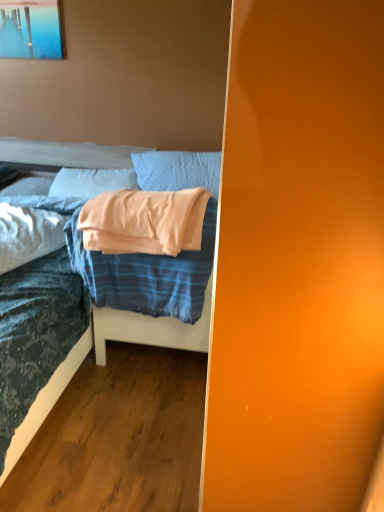
Question: Is metallic glossy picture frame at upper left bigger than light blue fabric pillow at upper center, arranged as the second pillow when viewed from the front?

Choices:
 (A) no
 (B) yes

Answer: (A)

Question: Is metallic glossy picture frame at upper left facing towards light blue fabric pillow at upper center, arranged as the second pillow when viewed from the front?

Choices:
 (A) yes
 (B) no

Answer: (B)

Question: Would you consider metallic glossy picture frame at upper left to be distant from light blue fabric pillow at upper center, arranged as the second pillow when viewed from the front?

Choices:
 (A) no
 (B) yes

Answer: (B)

Question: Considering the relative positions of metallic glossy picture frame at upper left and light blue fabric pillow at upper center, the third pillow from the back, in the image provided, is metallic glossy picture frame at upper left to the left of light blue fabric pillow at upper center, the third pillow from the back, from the viewer's perspective?

Choices:
 (A) yes
 (B) no

Answer: (A)

Question: From a real-world perspective, is metallic glossy picture frame at upper left located beneath light blue fabric pillow at upper center, the third pillow from the back?

Choices:
 (A) no
 (B) yes

Answer: (A)

Question: Considering the positions of metallic glossy picture frame at upper left and blue plaid bed at lower left in the image, is metallic glossy picture frame at upper left wider or thinner than blue plaid bed at lower left?

Choices:
 (A) thin
 (B) wide

Answer: (A)

Question: Is metallic glossy picture frame at upper left taller or shorter than blue plaid bed at lower left?

Choices:
 (A) short
 (B) tall

Answer: (B)

Question: Is point (44, 56) positioned closer to the camera than point (82, 357)?

Choices:
 (A) closer
 (B) farther

Answer: (B)

Question: From the image's perspective, relative to blue plaid bed at lower left, is metallic glossy picture frame at upper left above or below?

Choices:
 (A) below
 (B) above

Answer: (B)

Question: Is metallic glossy picture frame at upper left to the left or to the right of white soft pillow at upper left, arranged as the 1th pillow when viewed from the back, in the image?

Choices:
 (A) left
 (B) right

Answer: (B)

Question: In terms of width, does metallic glossy picture frame at upper left look wider or thinner when compared to white soft pillow at upper left, arranged as the 1th pillow when viewed from the back?

Choices:
 (A) wide
 (B) thin

Answer: (B)

Question: From a real-world perspective, relative to white soft pillow at upper left, arranged as the 1th pillow when viewed from the back, is metallic glossy picture frame at upper left vertically above or below?

Choices:
 (A) above
 (B) below

Answer: (A)

Question: Is point (4, 49) positioned closer to the camera than point (16, 181)?

Choices:
 (A) closer
 (B) farther

Answer: (A)

Question: From the image's perspective, is blue plaid bed at lower left located above or below white soft pillow at upper left, the 4th pillow positioned from the front?

Choices:
 (A) above
 (B) below

Answer: (B)

Question: Considering the positions of blue plaid bed at lower left and white soft pillow at upper left, the 4th pillow positioned from the front, in the image, is blue plaid bed at lower left taller or shorter than white soft pillow at upper left, the 4th pillow positioned from the front,?

Choices:
 (A) short
 (B) tall

Answer: (A)